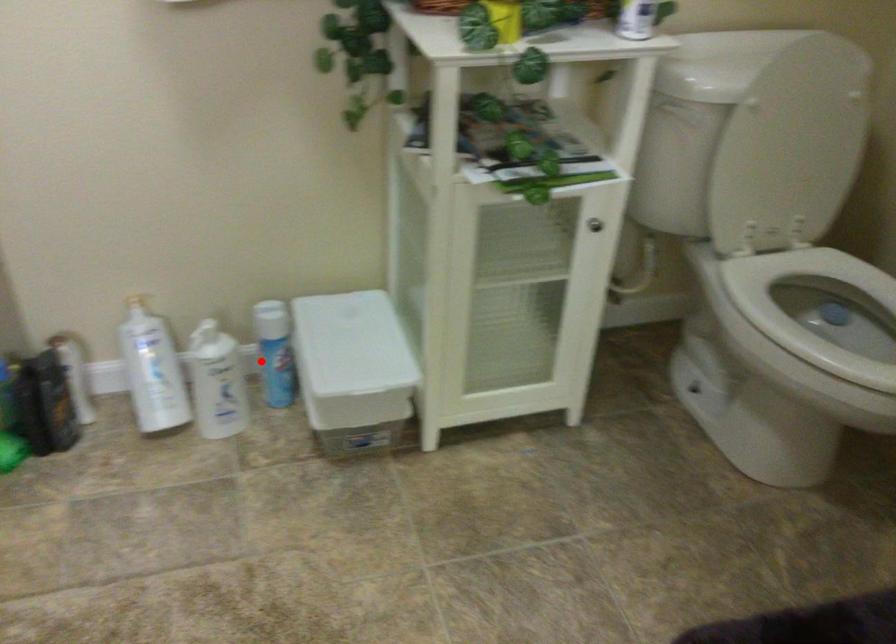
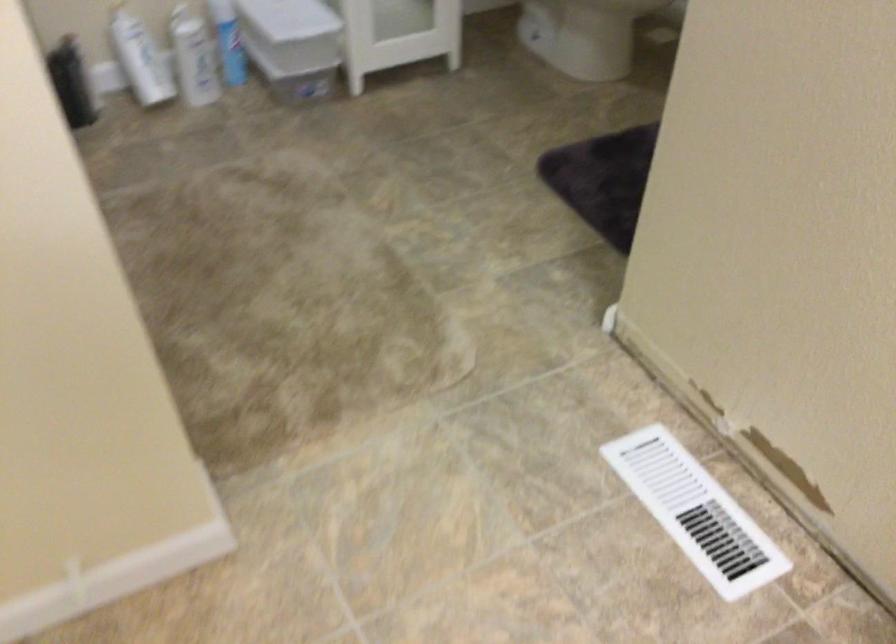
Question: A red point is marked in image1. In image2, is the corresponding 3D point closer to the camera or farther? Reply with the corresponding letter.

Choices:
 (A) The corresponding 3D point is closer.
 (B) The corresponding 3D point is farther.

Answer: (B)